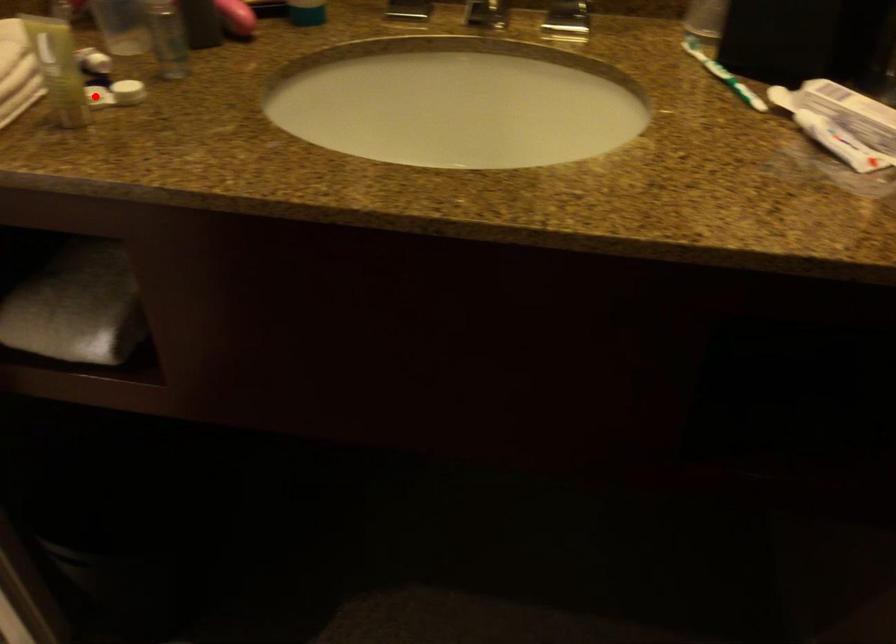
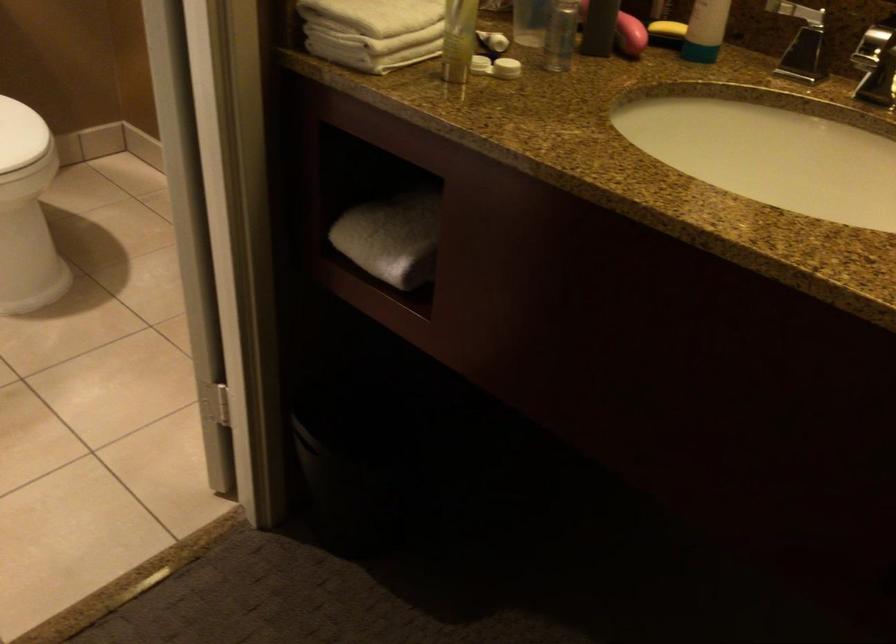
The point at the highlighted location is marked in the first image. Where is the corresponding point in the second image?

(479, 64)